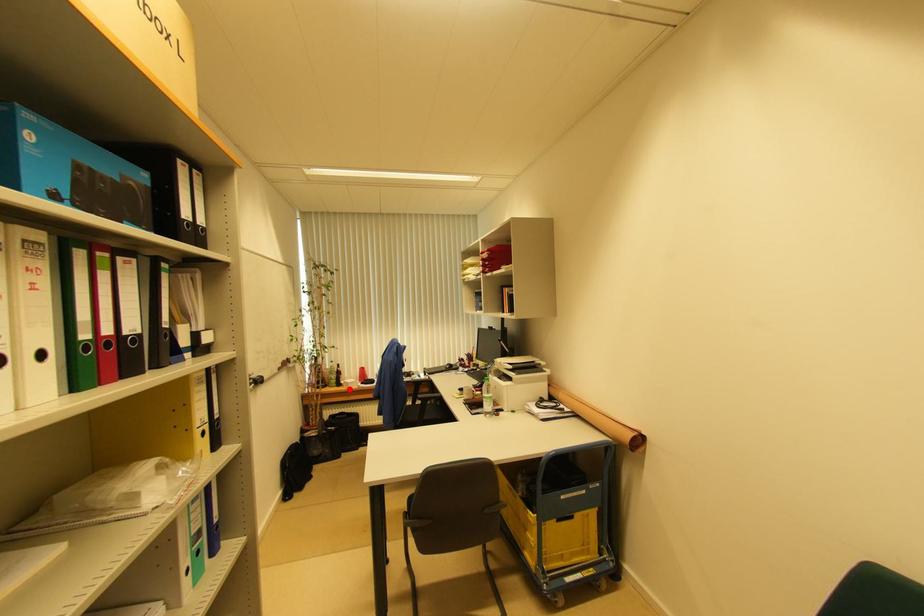
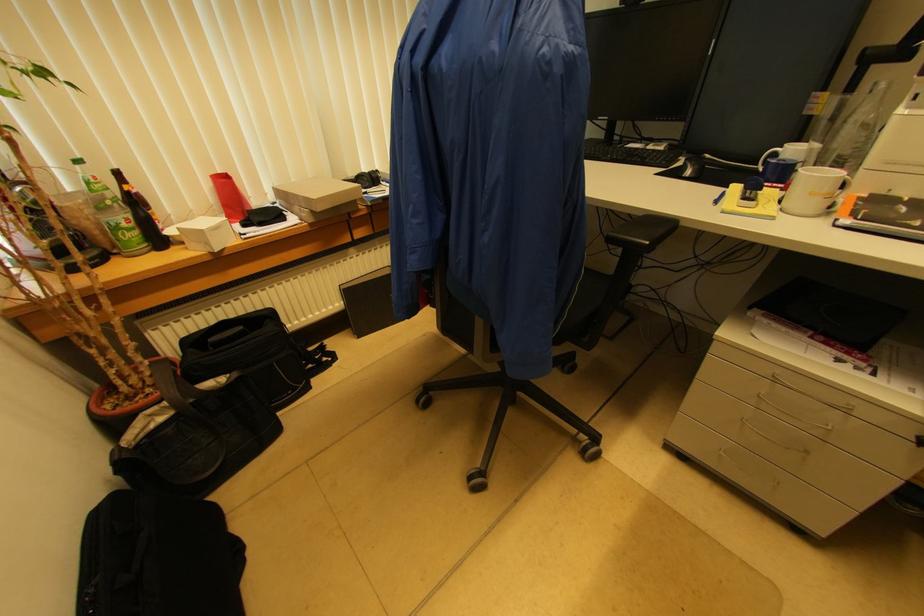
Where in the second image is the point corresponding to the highlighted location from the first image?

(209, 246)